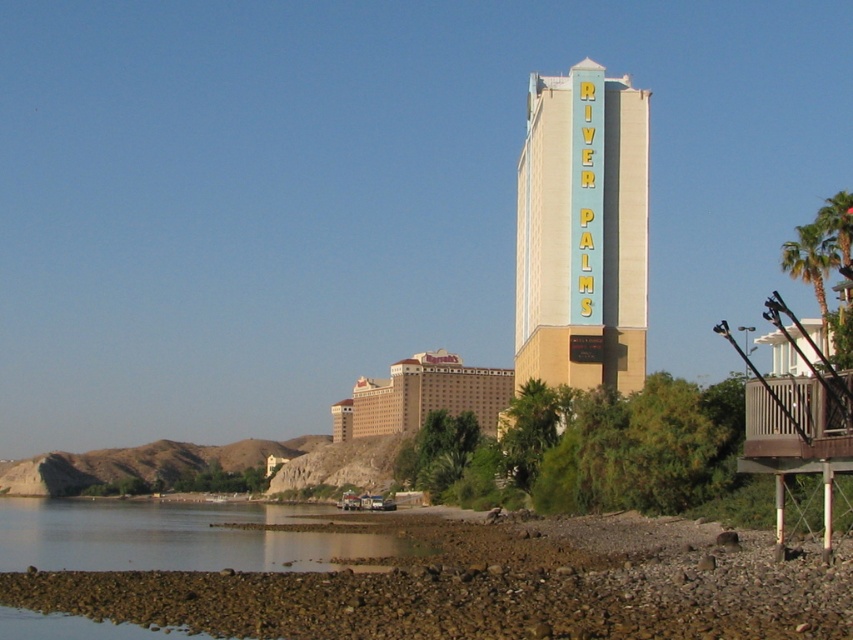
Is clear water at lower left shorter than green leafy palm tree at right?

Indeed, clear water at lower left has a lesser height compared to green leafy palm tree at right.

Is clear water at lower left bigger than green leafy palm tree at right?

No, clear water at lower left is not bigger than green leafy palm tree at right.

Where is `clear water at lower left`? clear water at lower left is located at coordinates (173, 536).

Does smooth gravel shoreline at lower center have a lesser height compared to beige/matte hotel at center?

No, smooth gravel shoreline at lower center is not shorter than beige/matte hotel at center.

Can you confirm if smooth gravel shoreline at lower center is wider than beige/matte hotel at center?

Yes.

The height and width of the screenshot is (640, 853). What do you see at coordinates (396, 577) in the screenshot?
I see `smooth gravel shoreline at lower center` at bounding box center [396, 577].

Identify the location of smooth gravel shoreline at lower center. Image resolution: width=853 pixels, height=640 pixels. (396, 577).

Does smooth gravel shoreline at lower center have a greater width compared to clear water at lower left?

No, smooth gravel shoreline at lower center is not wider than clear water at lower left.

The image size is (853, 640). What do you see at coordinates (396, 577) in the screenshot? I see `smooth gravel shoreline at lower center` at bounding box center [396, 577].

Find the location of a particular element. The image size is (853, 640). smooth gravel shoreline at lower center is located at coordinates (396, 577).